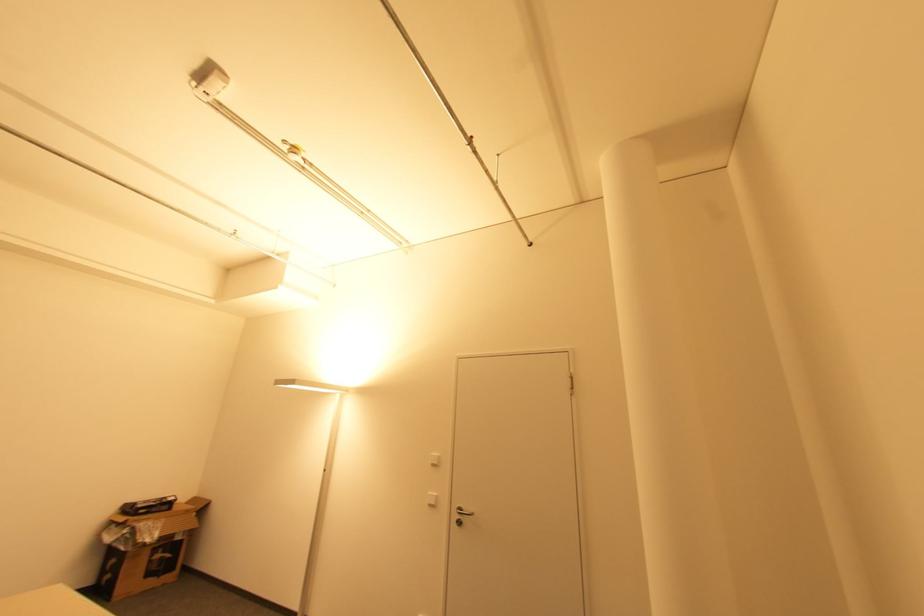
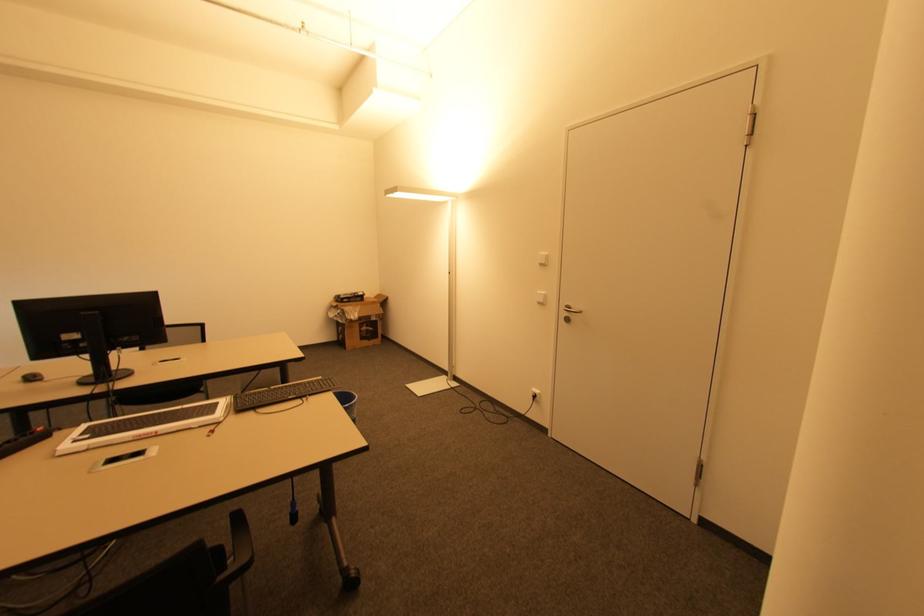
The point at (463, 524) is marked in the first image. Where is the corresponding point in the second image?

(568, 320)